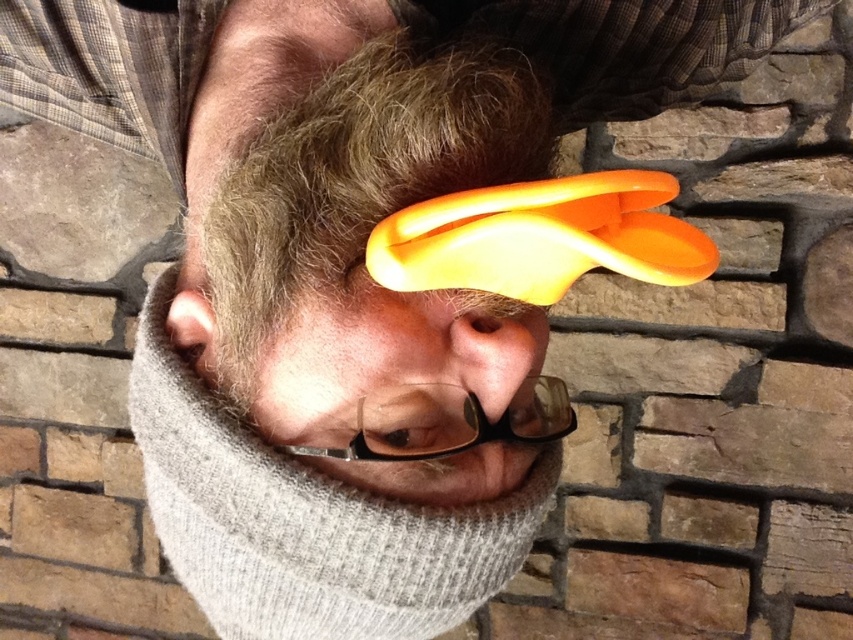
Question: Can you confirm if brown fuzzy hair at center is positioned to the left of gray woolen beard at center?

Choices:
 (A) no
 (B) yes

Answer: (A)

Question: Is gray woolen beard at center bigger than transparent plastic glasses at center?

Choices:
 (A) yes
 (B) no

Answer: (A)

Question: Among these points, which one is nearest to the camera?

Choices:
 (A) [x=416, y=394]
 (B) [x=469, y=566]
 (C) [x=231, y=323]

Answer: (A)

Question: Can you confirm if brown fuzzy hair at center is positioned to the right of gray woolen beard at center?

Choices:
 (A) no
 (B) yes

Answer: (B)

Question: Which of the following is the closest to the observer?

Choices:
 (A) brown fuzzy hair at center
 (B) transparent plastic glasses at center

Answer: (B)

Question: Which object appears closest to the camera in this image?

Choices:
 (A) transparent plastic glasses at center
 (B) brown fuzzy hair at center

Answer: (A)